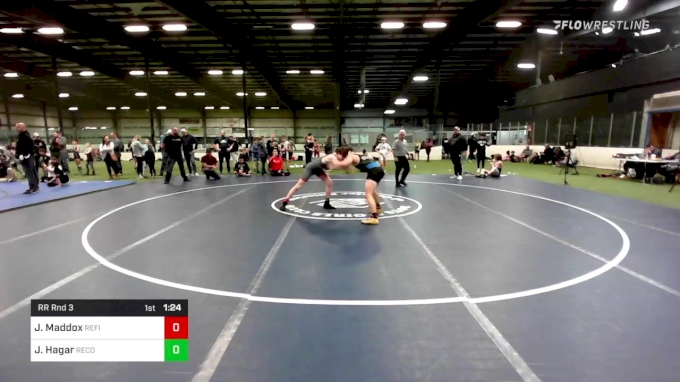
The width and height of the screenshot is (680, 382). In order to click on wall in this screenshot , I will do `click(262, 123)`.